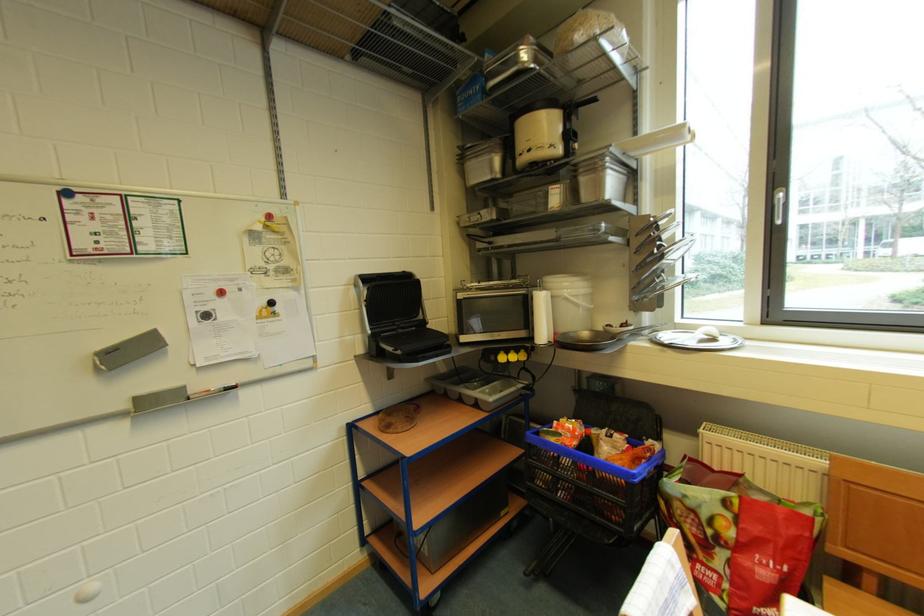
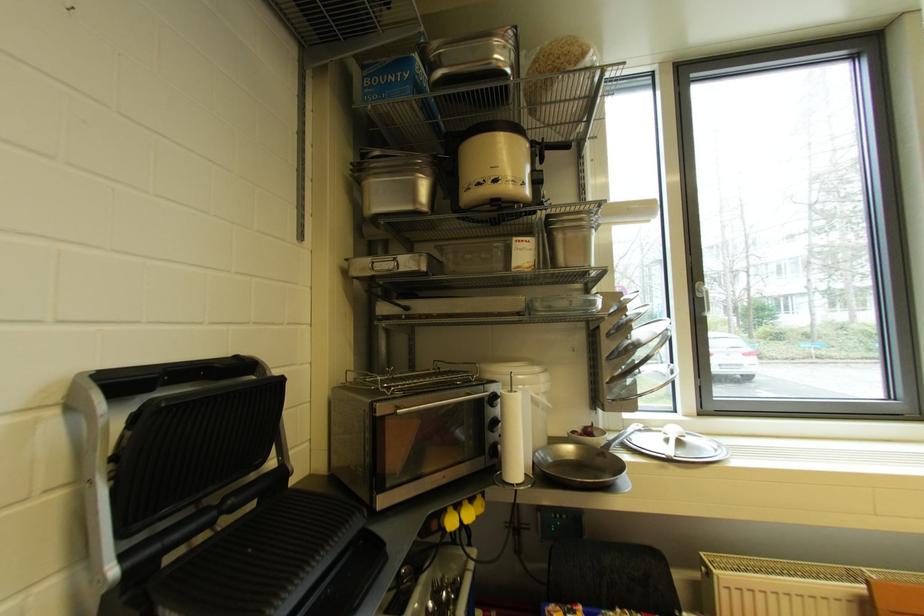
The point at (495, 180) is marked in the first image. Where is the corresponding point in the second image?

(418, 211)